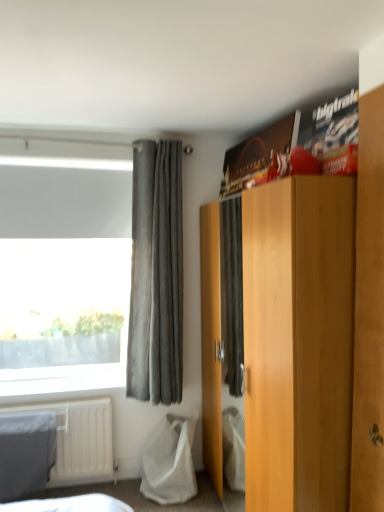
Question: From the image's perspective, is brown wooden wardrobe at upper right below gray suede curtain at left?

Choices:
 (A) yes
 (B) no

Answer: (A)

Question: From a real-world perspective, is brown wooden wardrobe at upper right located beneath gray suede curtain at left?

Choices:
 (A) yes
 (B) no

Answer: (A)

Question: Does brown wooden wardrobe at upper right have a lesser width compared to gray suede curtain at left?

Choices:
 (A) no
 (B) yes

Answer: (B)

Question: Does brown wooden wardrobe at upper right have a greater width compared to gray suede curtain at left?

Choices:
 (A) yes
 (B) no

Answer: (B)

Question: Does brown wooden wardrobe at upper right turn towards gray suede curtain at left?

Choices:
 (A) yes
 (B) no

Answer: (B)

Question: Is brown wooden wardrobe at upper right closer to camera compared to gray suede curtain at left?

Choices:
 (A) yes
 (B) no

Answer: (A)

Question: From a real-world perspective, is brown wooden wardrobe at upper right on top of white mesh bag at lower left?

Choices:
 (A) yes
 (B) no

Answer: (A)

Question: From a real-world perspective, is brown wooden wardrobe at upper right positioned under white mesh bag at lower left based on gravity?

Choices:
 (A) no
 (B) yes

Answer: (A)

Question: Is brown wooden wardrobe at upper right further to the viewer compared to white mesh bag at lower left?

Choices:
 (A) yes
 (B) no

Answer: (B)

Question: Does brown wooden wardrobe at upper right turn towards white mesh bag at lower left?

Choices:
 (A) yes
 (B) no

Answer: (B)

Question: From the image's perspective, is brown wooden wardrobe at upper right on white mesh bag at lower left?

Choices:
 (A) no
 (B) yes

Answer: (B)

Question: Is brown wooden wardrobe at upper right thinner than white mesh bag at lower left?

Choices:
 (A) yes
 (B) no

Answer: (A)

Question: Considering the relative positions of light brown wood cabinet at center and white mesh bag at lower left in the image provided, is light brown wood cabinet at center to the right of white mesh bag at lower left from the viewer's perspective?

Choices:
 (A) no
 (B) yes

Answer: (B)